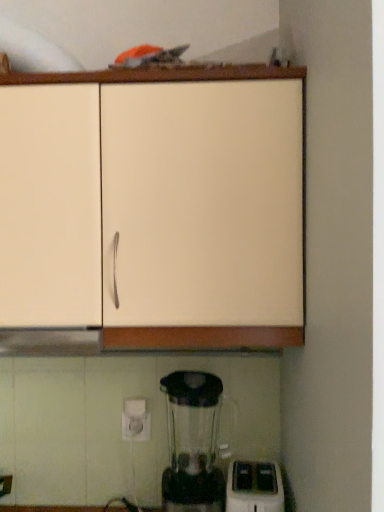
Question: Which is correct: white plastic toaster at lower right is inside matte white cabinet at upper center, or outside of it?

Choices:
 (A) outside
 (B) inside

Answer: (A)

Question: Considering the relative positions of white plastic toaster at lower right and matte white cabinet at upper center in the image provided, is white plastic toaster at lower right to the left or to the right of matte white cabinet at upper center?

Choices:
 (A) left
 (B) right

Answer: (B)

Question: Looking at the image, does white plastic toaster at lower right seem bigger or smaller compared to matte white cabinet at upper center?

Choices:
 (A) big
 (B) small

Answer: (B)

Question: Considering their positions, is matte white cabinet at upper center located in front of or behind white plastic toaster at lower right?

Choices:
 (A) behind
 (B) front

Answer: (B)

Question: Considering the positions of matte white cabinet at upper center and white plastic toaster at lower right in the image, is matte white cabinet at upper center bigger or smaller than white plastic toaster at lower right?

Choices:
 (A) big
 (B) small

Answer: (A)

Question: Is matte white cabinet at upper center inside or outside of white plastic toaster at lower right?

Choices:
 (A) outside
 (B) inside

Answer: (A)

Question: Considering the relative positions of matte white cabinet at upper center and white plastic toaster at lower right in the image provided, is matte white cabinet at upper center to the left or to the right of white plastic toaster at lower right?

Choices:
 (A) right
 (B) left

Answer: (B)